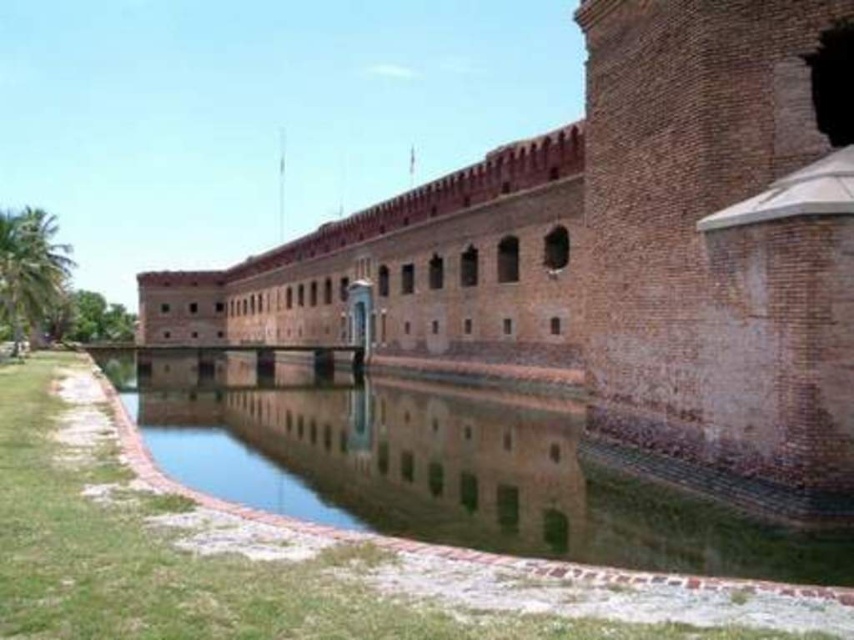
Is point (524, 349) positioned in front of point (769, 560)?

No, it is behind (769, 560).

Does brown brick wall at center have a lesser height compared to clear water at center?

No.

Is point (572, 154) closer to viewer compared to point (336, 518)?

No, (572, 154) is behind (336, 518).

Where is `brown brick wall at center`? brown brick wall at center is located at coordinates (621, 256).